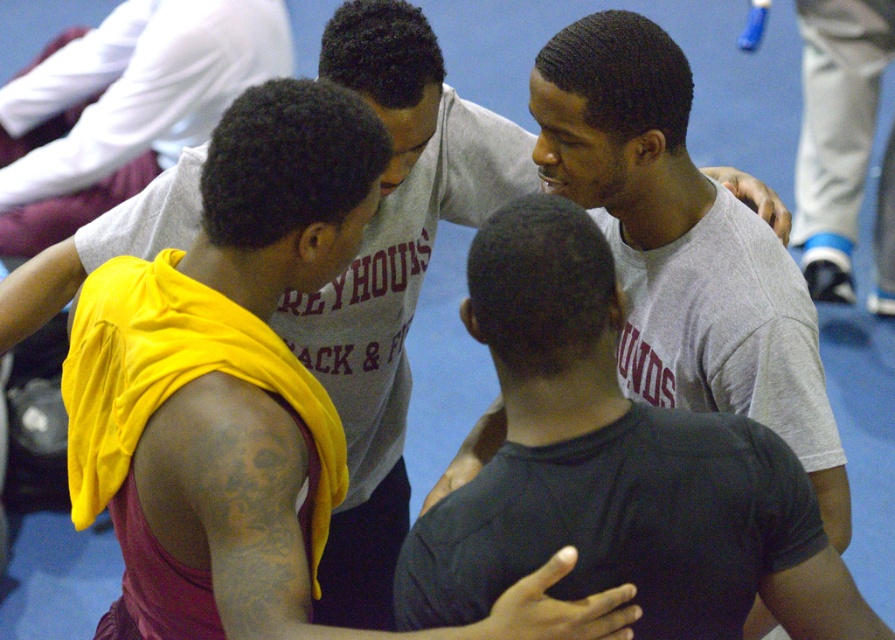
Question: Which of these objects is positioned closest to the yellow fabric at left?

Choices:
 (A) gray fabric shoe at right
 (B) gray matte t-shirt at center

Answer: (A)

Question: Which object is positioned farthest from the gray matte t-shirt at center?

Choices:
 (A) yellow fabric at left
 (B) gray fabric shoe at right

Answer: (B)

Question: Is gray matte t-shirt at center below gray fabric shoe at right?

Choices:
 (A) no
 (B) yes

Answer: (B)

Question: Can you confirm if gray matte t-shirt at center is bigger than yellow fabric at left?

Choices:
 (A) yes
 (B) no

Answer: (B)

Question: Which point is closer to the camera taking this photo?

Choices:
 (A) pyautogui.click(x=870, y=113)
 (B) pyautogui.click(x=548, y=212)
 (C) pyautogui.click(x=13, y=218)

Answer: (B)

Question: Does gray matte t-shirt at center appear under gray fabric shoe at right?

Choices:
 (A) yes
 (B) no

Answer: (A)